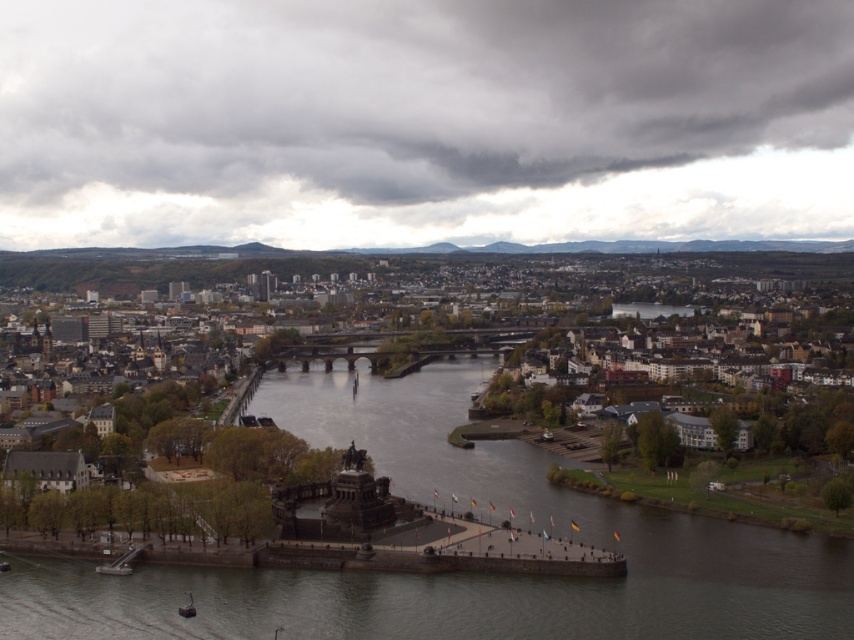
Based on the photo, you are a hot air balloon pilot preparing to land in the city. Your landing zone is between the dark gray cloud at upper center and the monument in the foreground. Can you safely land there if your balloon requires a minimum of 500 meters of space?

The dark gray cloud at upper center and the monument in the foreground are 625.16 meters apart, which is more than the required 500 meters, so you can safely land there.

In the scene shown: You are a photographer positioned at the monument in the cityscape image. You want to capture a photo that includes both the monument and the dark gray cloud at upper center. Based on their positions, can you estimate the angle you need to tilt your camera upwards to include both in the frame?

The dark gray cloud at upper center is located at point (407, 93) in 2D coordinates, so you would need to tilt your camera slightly upwards to capture both the monument and the cloud in the frame.